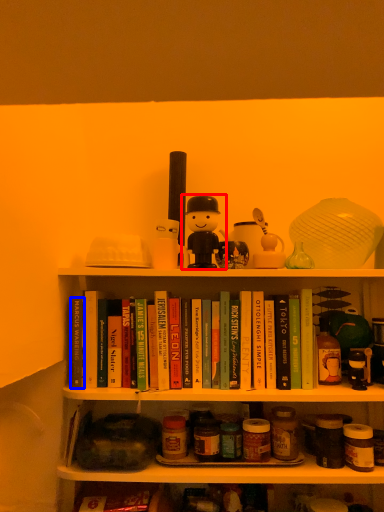
Question: Which point is further to the camera, toy (highlighted by a red box) or paperback book (highlighted by a blue box)?

Choices:
 (A) toy
 (B) paperback book

Answer: (B)